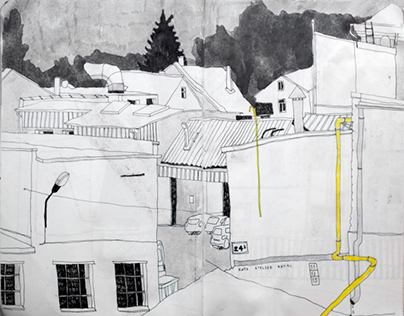
Image resolution: width=404 pixels, height=316 pixels. In order to click on windows in this screenshot , I will do `click(79, 282)`, `click(121, 276)`, `click(8, 282)`.